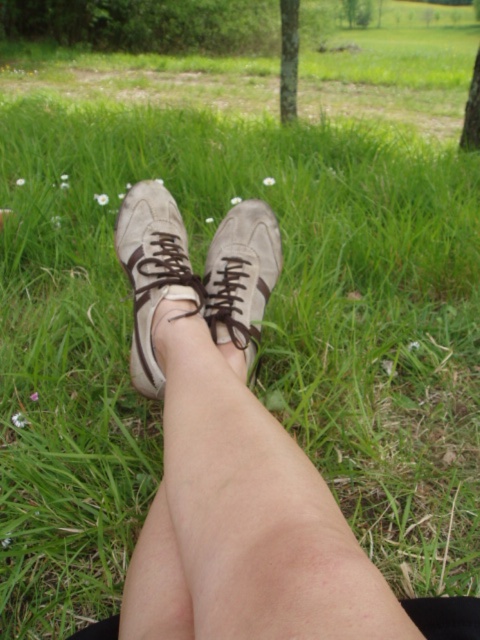
You are a photographer trying to capture the matte beige sneaker at center and the green leafy tree at upper center in the same frame. Based on their sizes, which object would you need to zoom in more on to ensure both are clearly visible?

The matte beige sneaker at center has a lesser width compared to the green leafy tree at upper center, so you would need to zoom in more on the matte beige sneaker at center to ensure both are clearly visible.